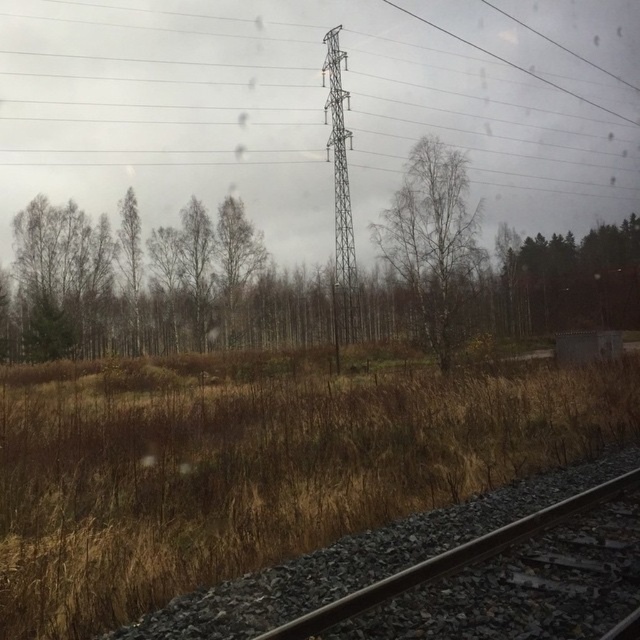
Question: Is brown dry grass at lower left wider than metallic gray tower at center?

Choices:
 (A) no
 (B) yes

Answer: (B)

Question: Is metallic tower at upper center thinner than bare branches at center?

Choices:
 (A) no
 (B) yes

Answer: (A)

Question: Among these points, which one is farthest from the camera?

Choices:
 (A) (352, 136)
 (B) (504, 132)

Answer: (B)

Question: Which point appears farthest from the camera in this image?

Choices:
 (A) (337, 104)
 (B) (230, 426)
 (C) (586, 300)

Answer: (A)

Question: Can you confirm if brown dry grass at lower left is thinner than green leafy tree at right?

Choices:
 (A) no
 (B) yes

Answer: (A)

Question: Which object is farther from the camera taking this photo?

Choices:
 (A) bare branches at center
 (B) metallic gray tower at center

Answer: (B)